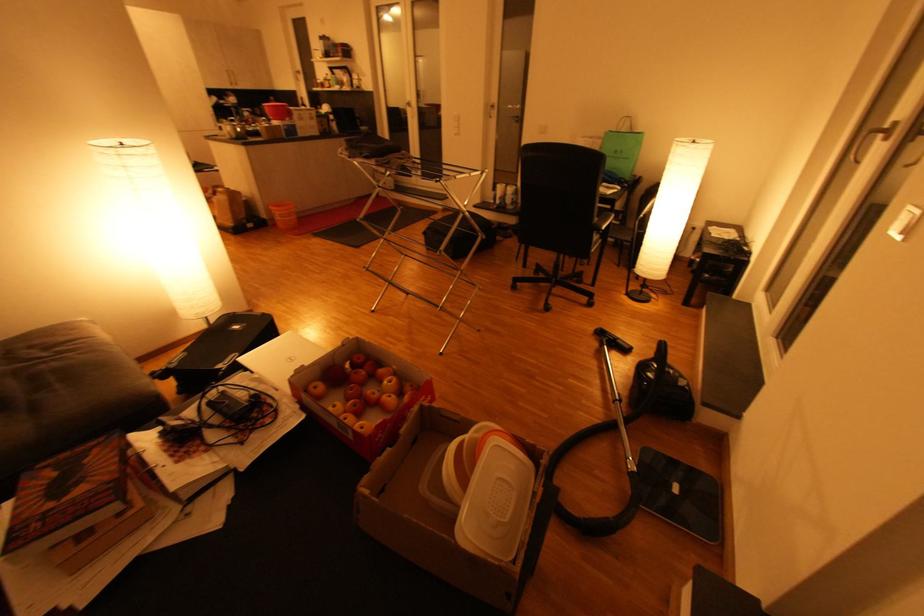
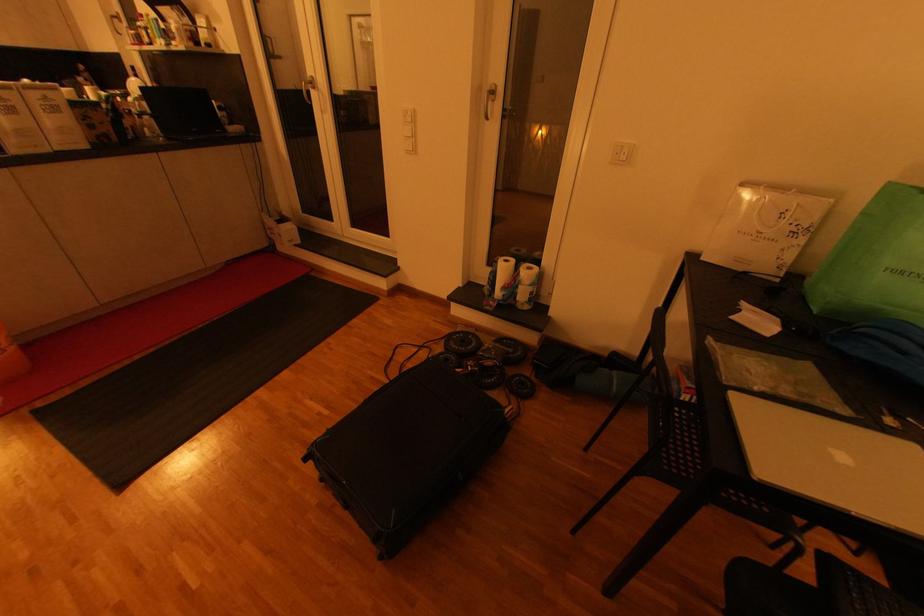
Question: In a continuous first-person perspective shot, in which direction is the camera moving?

Choices:
 (A) Left
 (B) Right
 (C) Forward
 (D) Backward

Answer: (C)